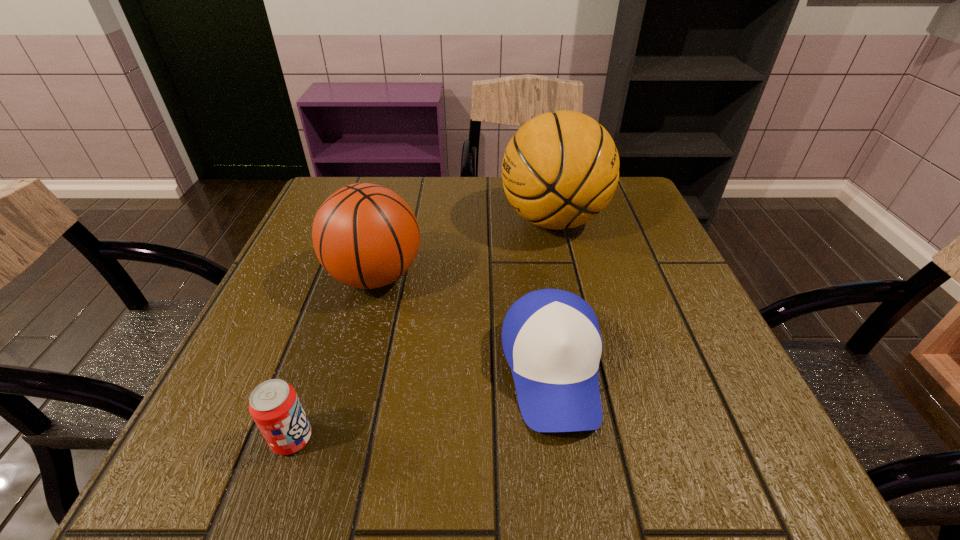
Find the location of a particular element. The height and width of the screenshot is (540, 960). free region located 0.270m on the surface of the soda can is located at coordinates (499, 438).

Locate an element on the screen. The width and height of the screenshot is (960, 540). object present at the far edge is located at coordinates (561, 169).

Locate an element on the screen. This screenshot has width=960, height=540. baseball cap present at the near edge is located at coordinates (551, 339).

Locate an element on the screen. This screenshot has width=960, height=540. soda can that is at the near edge is located at coordinates (274, 405).

The image size is (960, 540). Find the location of `basketball that is at the left edge`. basketball that is at the left edge is located at coordinates click(x=366, y=236).

Locate an element on the screen. soda can that is at the left edge is located at coordinates (274, 405).

You are a GUI agent. You are given a task and a screenshot of the screen. Output one action in this format:
    pyautogui.click(x=<x>, y=<y>)
    Task: Click on the object positioned at the right edge
    Image resolution: width=960 pixels, height=540 pixels.
    Given the screenshot: What is the action you would take?
    pyautogui.click(x=561, y=169)

You are a GUI agent. You are given a task and a screenshot of the screen. Output one action in this format:
    pyautogui.click(x=<x>, y=<y>)
    Task: Click on the object positioned at the near left corner
    
    Given the screenshot: What is the action you would take?
    pyautogui.click(x=274, y=405)

Find the location of a particular element. Image resolution: width=960 pixels, height=540 pixels. object situated at the far right corner is located at coordinates (561, 169).

In the image, there is a desktop. Where is `vacant space at the far edge`? vacant space at the far edge is located at coordinates (468, 208).